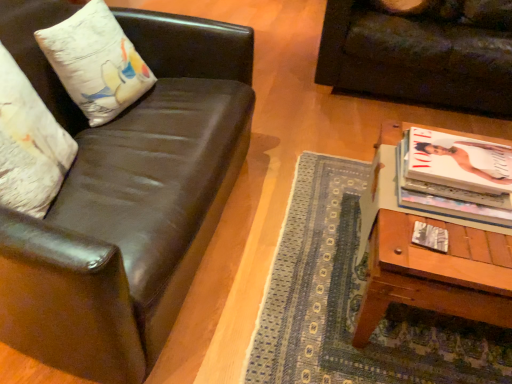
Locate an element on the screen. Image resolution: width=512 pixels, height=384 pixels. free space that is in between white glossy magazine at right and matte white magazine at right is located at coordinates (452, 233).